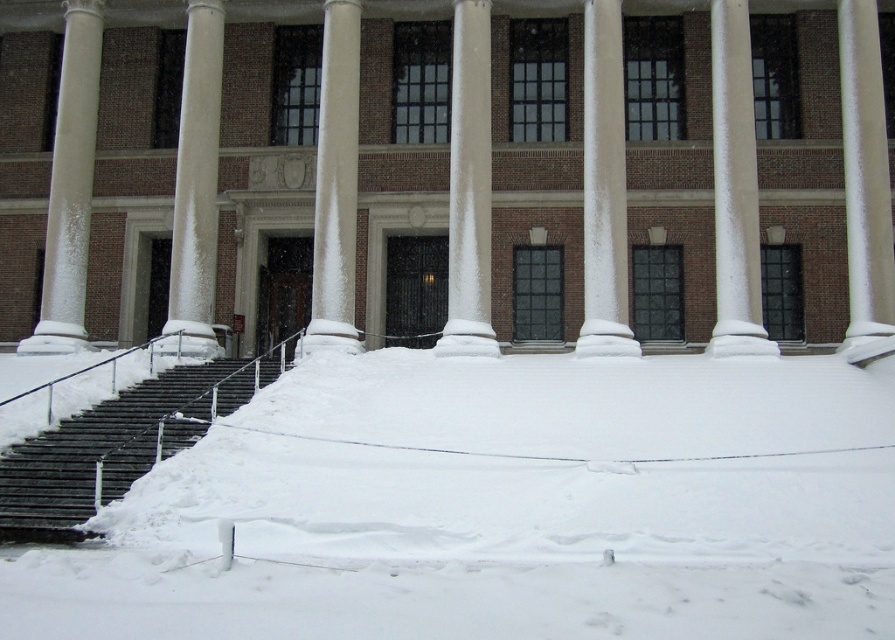
Who is positioned more to the right, dark gray concrete stairs at lower left or white frosted pillar at right?

white frosted pillar at right

Who is higher up, dark gray concrete stairs at lower left or white frosted pillar at right?

white frosted pillar at right is higher up.

This screenshot has width=895, height=640. I want to click on dark gray concrete stairs at lower left, so click(x=114, y=445).

Describe the element at coordinates (114, 445) in the screenshot. Image resolution: width=895 pixels, height=640 pixels. I see `dark gray concrete stairs at lower left` at that location.

Can you confirm if dark gray concrete stairs at lower left is shorter than white textured column at left?

Yes.

Who is more distant from viewer, [134,472] or [83,144]?

Positioned behind is point [83,144].

Identify the location of dark gray concrete stairs at lower left. (114, 445).

Which is above, white smooth column at center or white frosty column at left?

white smooth column at center is above.

Is white smooth column at center taller than white frosty column at left?

In fact, white smooth column at center may be shorter than white frosty column at left.

Measure the distance between white smooth column at center and camera.

They are 23.66 meters apart.

The width and height of the screenshot is (895, 640). I want to click on white smooth column at center, so pos(604,188).